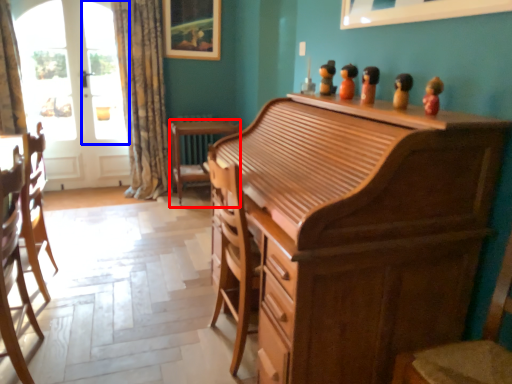
Question: Which object is further to the camera taking this photo, desk (highlighted by a red box) or window screen (highlighted by a blue box)?

Choices:
 (A) desk
 (B) window screen

Answer: (B)